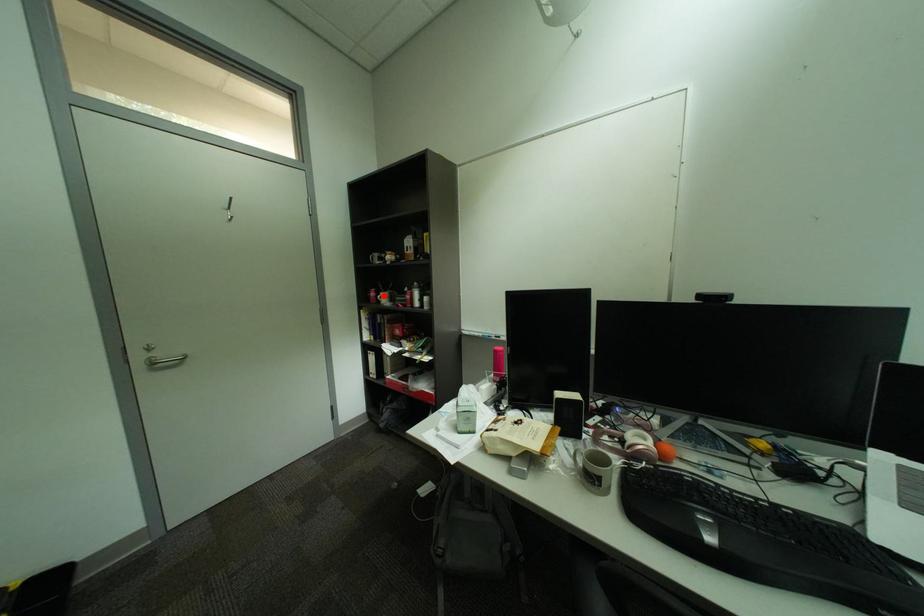
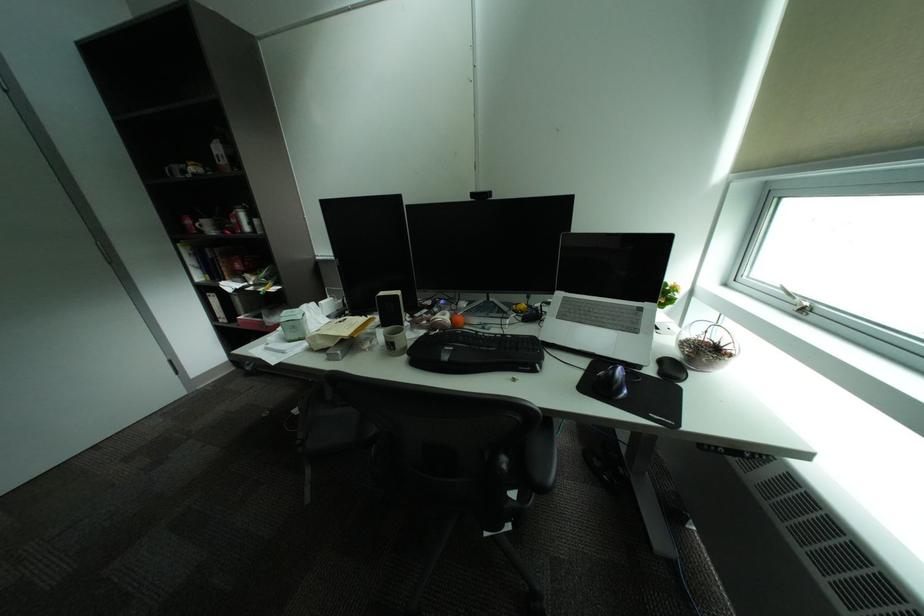
Locate, in the second image, the point that corresponds to the highlighted location in the first image.

(199, 223)